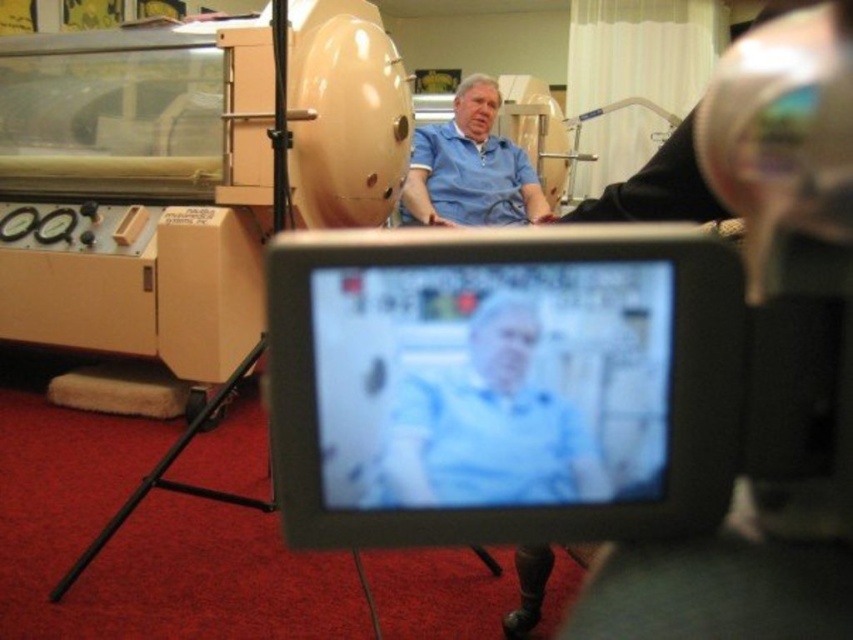
Question: Does blue fabric at center lie behind blue smooth shirt at center?

Choices:
 (A) no
 (B) yes

Answer: (A)

Question: Which point is closer to the camera taking this photo?

Choices:
 (A) (483, 326)
 (B) (421, 134)

Answer: (A)

Question: Is blue fabric at center thinner than blue smooth shirt at center?

Choices:
 (A) no
 (B) yes

Answer: (B)

Question: Is blue fabric at center bigger than blue smooth shirt at center?

Choices:
 (A) yes
 (B) no

Answer: (B)